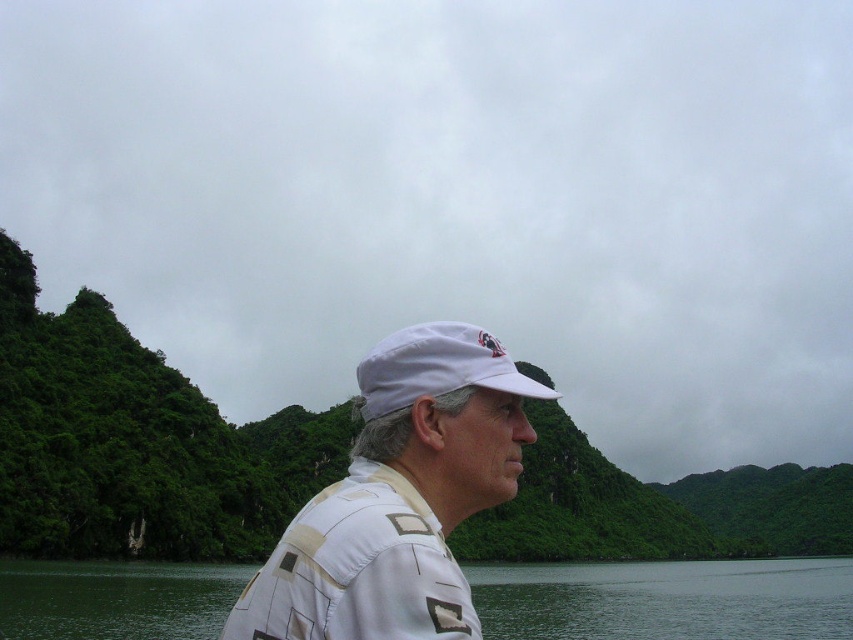
You are a photographer trying to capture both the white matte cap at center and the white fabric cap at center in the same frame. Given that your camera has a maximum focus range of 5 meters, will you be able to capture both subjects clearly in one shot?

The distance between the white matte cap at center and the white fabric cap at center is 4.80 meters, which is within the camera maximum focus range of 5 meters. Therefore, you can capture both subjects clearly in one shot.

You are a photographer trying to capture the person in the scene. You notice two caps on their head. Which one is bigger in size between the white matte cap at center and the white fabric cap at center?

The white matte cap at center has a larger size compared to the white fabric cap at center, so the white matte cap at center is bigger.

From the picture: You are a photographer trying to capture the person wearing the white matte cap at center in the image. If the camera viewfinder has a grid divided into 9 equal squares, where would you position the cap to ensure it aligns with the central intersection point of the grid?

The white matte cap at center is located at coordinates 0.777 on the x and 0.469 on the y axis. Since the central intersection point of a 3x3 grid is at the center coordinates of the image, the cap is slightly to the right and above the center point. To align it with the central intersection, move the camera slightly to the left and down.